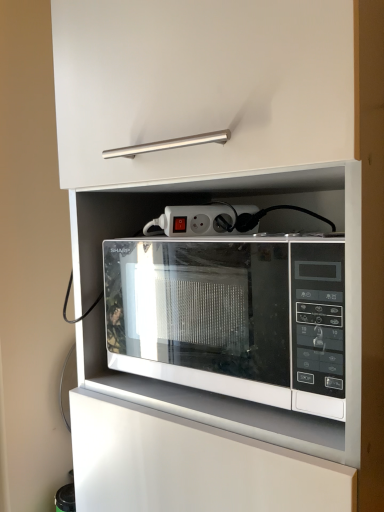
Question: From their relative heights in the image, would you say white plastic power strip at center is taller or shorter than white glossy microwave at center?

Choices:
 (A) tall
 (B) short

Answer: (B)

Question: From a real-world perspective, is white plastic power strip at center positioned above or below white glossy microwave at center?

Choices:
 (A) above
 (B) below

Answer: (A)

Question: In terms of width, does white plastic power strip at center look wider or thinner when compared to white glossy microwave at center?

Choices:
 (A) thin
 (B) wide

Answer: (A)

Question: From a real-world perspective, relative to white plastic power strip at center, is white glossy microwave at center vertically above or below?

Choices:
 (A) above
 (B) below

Answer: (B)

Question: Is point (187, 371) positioned closer to the camera than point (165, 221)?

Choices:
 (A) farther
 (B) closer

Answer: (B)

Question: Considering the positions of white glossy microwave at center and white plastic power strip at center in the image, is white glossy microwave at center taller or shorter than white plastic power strip at center?

Choices:
 (A) tall
 (B) short

Answer: (A)

Question: Relative to white plastic power strip at center, is white glossy microwave at center in front or behind?

Choices:
 (A) behind
 (B) front

Answer: (B)